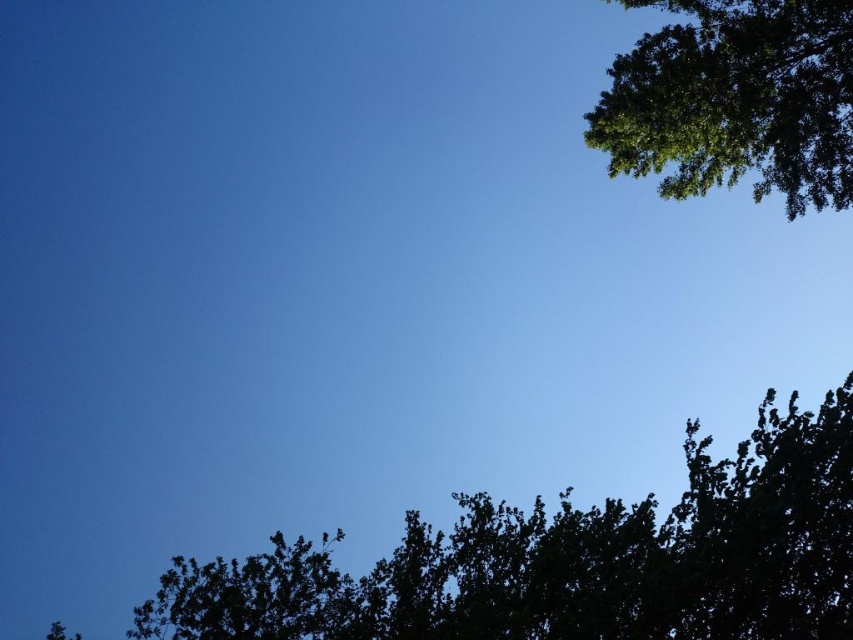
Which of these two, dark green leafy tree at lower center or green leafy tree at upper right, stands taller?

dark green leafy tree at lower center

Measure the distance between dark green leafy tree at lower center and camera.

dark green leafy tree at lower center and camera are 40.60 feet apart from each other.

What do you see at coordinates (573, 561) in the screenshot? The width and height of the screenshot is (853, 640). I see `dark green leafy tree at lower center` at bounding box center [573, 561].

Identify the location of dark green leafy tree at lower center. (573, 561).